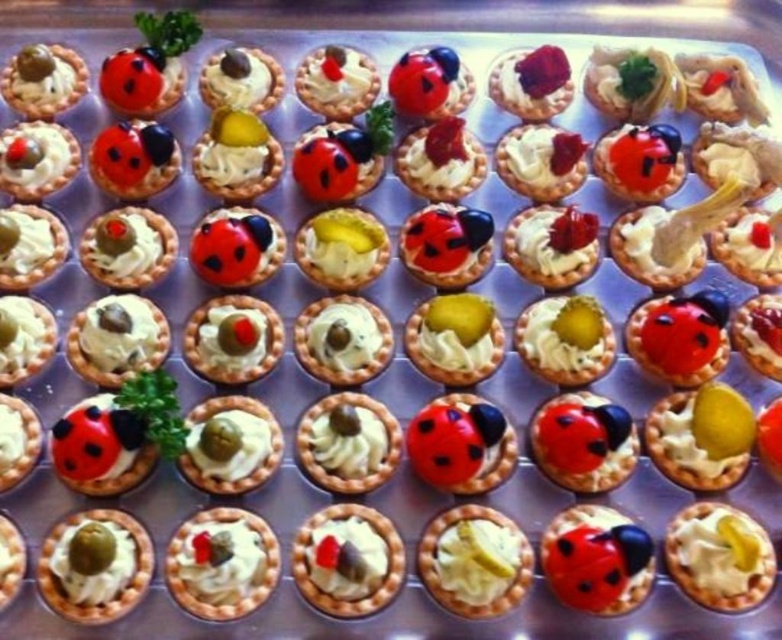
Question: Which point is closer to the camera?

Choices:
 (A) matte black ladybug at center
 (B) green matte olive at lower left
 (C) white cream tart at center

Answer: (B)

Question: Estimate the real-world distances between objects in this image. Which object is farther from the white cream tart at center?

Choices:
 (A) matte white tartlet at center
 (B) matte black ladybug at center
 (C) matte white tartlet at lower left

Answer: (B)

Question: Is green matte olive at lower left further to the viewer compared to matte black ladybug at center?

Choices:
 (A) no
 (B) yes

Answer: (A)

Question: Can you confirm if matte black ladybug at center is positioned below matte white tartlet at lower left?

Choices:
 (A) yes
 (B) no

Answer: (B)

Question: In this image, where is matte black ladybug at center located relative to matte white tartlet at lower left?

Choices:
 (A) left
 (B) right

Answer: (B)

Question: Which object is farther from the camera taking this photo?

Choices:
 (A) matte cream tartlet at center
 (B) green matte olive at lower left
 (C) matte white tartlet at center
 (D) matte white tartlet at lower left

Answer: (A)